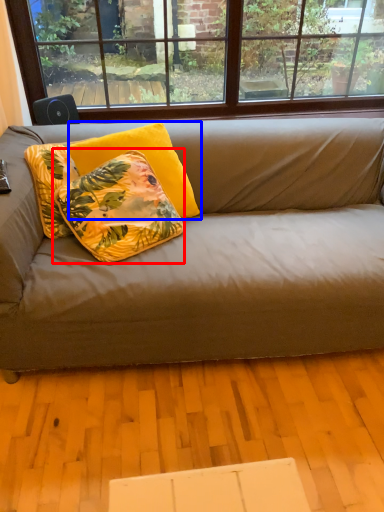
Question: Among these objects, which one is nearest to the camera, pillow (highlighted by a red box) or pillow (highlighted by a blue box)?

Choices:
 (A) pillow
 (B) pillow

Answer: (A)